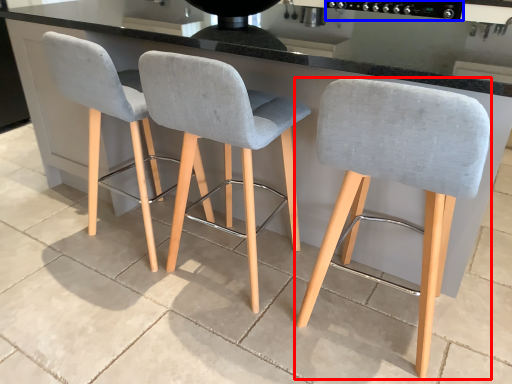
Question: Among these objects, which one is nearest to the camera, chair (highlighted by a red box) or appliance (highlighted by a blue box)?

Choices:
 (A) chair
 (B) appliance

Answer: (A)